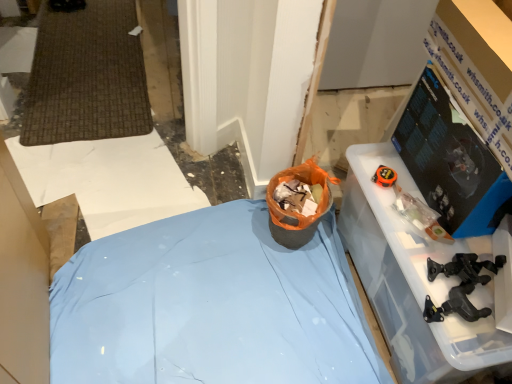
Image resolution: width=512 pixels, height=384 pixels. I want to click on vacant space behind black plastic tool at lower right, so click(424, 254).